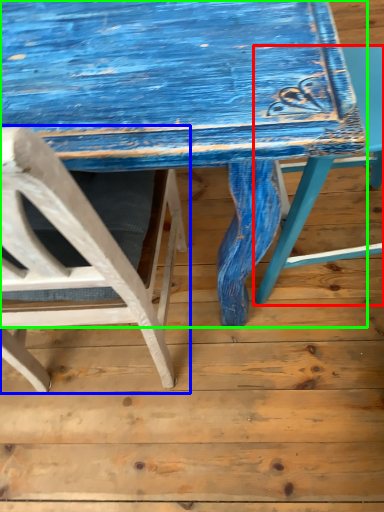
Question: Based on their relative distances, which object is nearer to chair (highlighted by a red box)? Choose from chair (highlighted by a blue box) and table (highlighted by a green box).

Choices:
 (A) chair
 (B) table

Answer: (B)